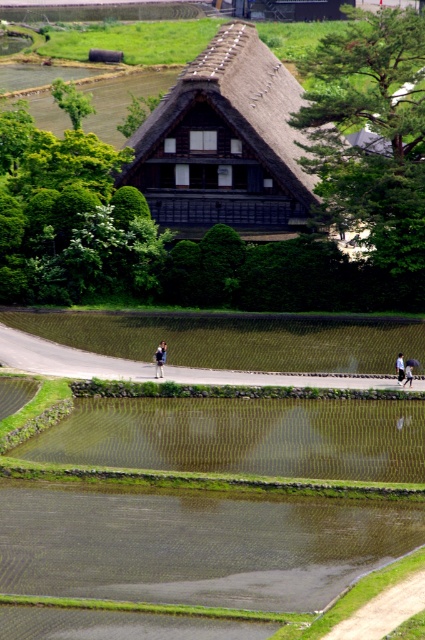
Question: Which object is the farthest from the blue fabric umbrella at lower center?

Choices:
 (A) blue denim jacket at lower center
 (B) light blue fabric at lower right
 (C) thatched wood hut at center

Answer: (C)

Question: Can you confirm if thatched wood hut at center is positioned above blue fabric umbrella at lower center?

Choices:
 (A) no
 (B) yes

Answer: (B)

Question: Can you confirm if thatched wood hut at center is thinner than blue denim jacket at lower center?

Choices:
 (A) yes
 (B) no

Answer: (B)

Question: Observing the image, what is the correct spatial positioning of thatched wood hut at center in reference to blue fabric umbrella at lower center?

Choices:
 (A) below
 (B) above

Answer: (B)

Question: Which object is closer to the camera taking this photo?

Choices:
 (A) light blue fabric at lower right
 (B) blue denim jacket at lower center

Answer: (A)

Question: Which of the following is the closest to the observer?

Choices:
 (A) (401, 376)
 (B) (159, 369)
 (C) (410, 364)

Answer: (A)